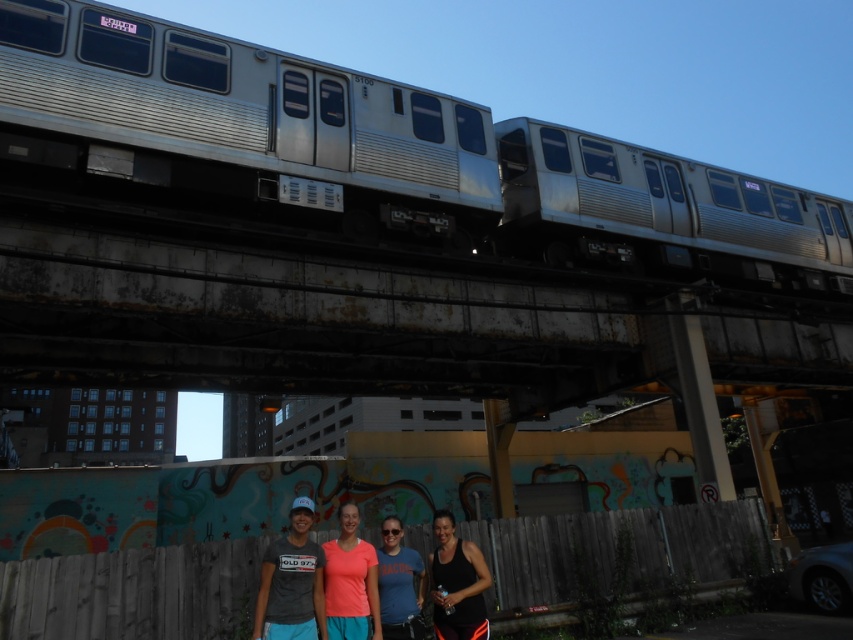
Question: Which object appears closest to the camera in this image?

Choices:
 (A) silver metallic train at upper center
 (B) matte blue t-shirt at center
 (C) matte coral t-shirt at center
 (D) black tank top at center

Answer: (C)

Question: Can you confirm if matte coral t-shirt at center is positioned above matte blue t-shirt at center?

Choices:
 (A) no
 (B) yes

Answer: (B)

Question: Which is nearer to the matte coral t-shirt at center?

Choices:
 (A) silver metallic train at upper center
 (B) matte blue t-shirt at center
 (C) black tank top at center

Answer: (B)

Question: Is black tank top at center wider than matte coral t-shirt at center?

Choices:
 (A) yes
 (B) no

Answer: (B)

Question: Is black tank top at center bigger than matte blue t-shirt at center?

Choices:
 (A) yes
 (B) no

Answer: (A)

Question: Among these points, which one is farthest from the camera?

Choices:
 (A) (361, 625)
 (B) (445, 620)
 (C) (318, 214)

Answer: (C)